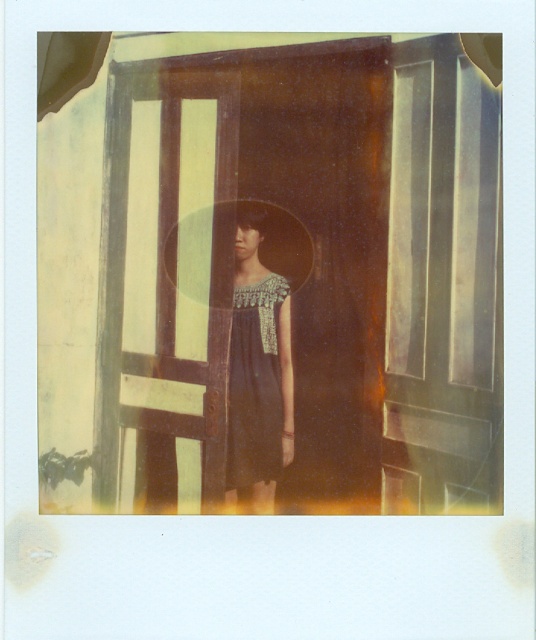
Does black satin dress at center appear on the left side of dark blue textured dress at center?

In fact, black satin dress at center is to the right of dark blue textured dress at center.

Between black satin dress at center and dark blue textured dress at center, which one is positioned lower?

Positioned lower is dark blue textured dress at center.

The height and width of the screenshot is (640, 536). Describe the element at coordinates (257, 368) in the screenshot. I see `black satin dress at center` at that location.

Where is `black satin dress at center`? The image size is (536, 640). black satin dress at center is located at coordinates (257, 368).